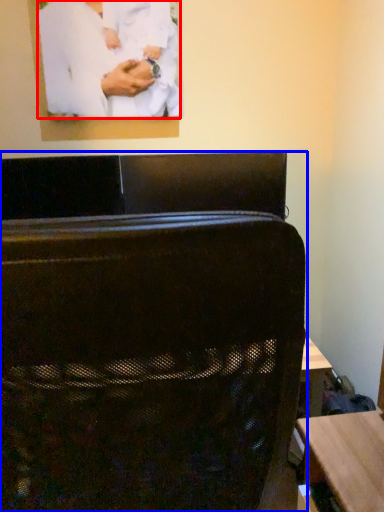
Question: Which of the following is the farthest to the observer, person (highlighted by a red box) or furniture (highlighted by a blue box)?

Choices:
 (A) person
 (B) furniture

Answer: (A)